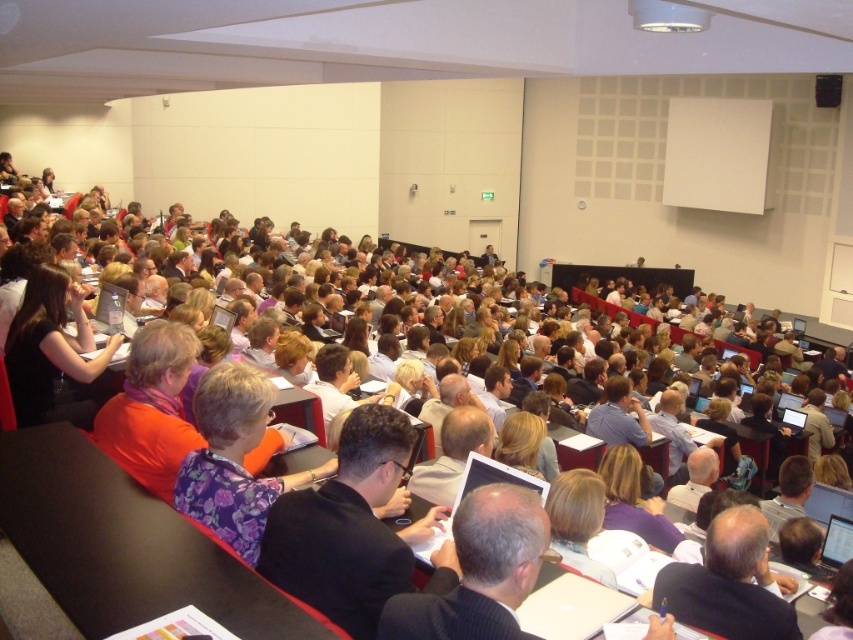
You are organizing a photo shoot in the lecture hall and need to position two models wearing the dark suit at center and the floral fabric shirt at center. The models need to stand side by side without overlapping. Based on the scene, can you determine if there is enough space between them?

The dark suit at center might be wider than floral fabric shirt at center, so there might not be enough space between them to stand side by side without overlapping. Adjust their positions to ensure adequate spacing.

You are sitting in the back row of the lecture hall and notice two individuals at the center of the room. You see the dark suit at center and the floral fabric shirt at center. Which one is positioned higher up in the room?

The dark suit at center is located above the floral fabric shirt at center, so it is positioned higher up in the room.